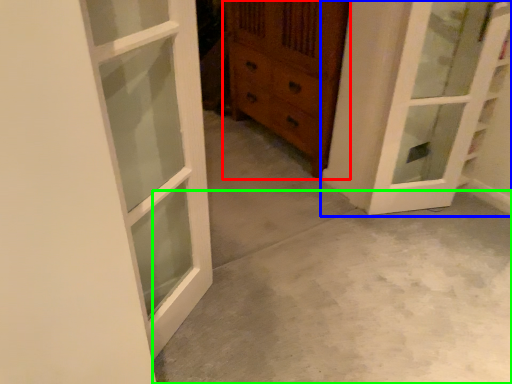
Question: Estimate the real-world distances between objects in this image. Which object is farther from chest of drawers (highlighted by a red box), door (highlighted by a blue box) or concrete (highlighted by a green box)?

Choices:
 (A) door
 (B) concrete

Answer: (B)